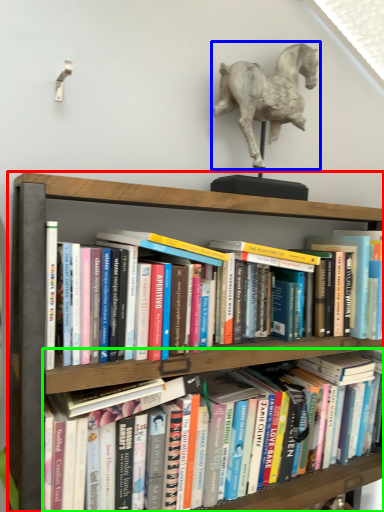
Question: Which object is the farthest from shelf (highlighted by a red box)? Choose among these: horse (highlighted by a blue box) or book (highlighted by a green box).

Choices:
 (A) horse
 (B) book

Answer: (B)